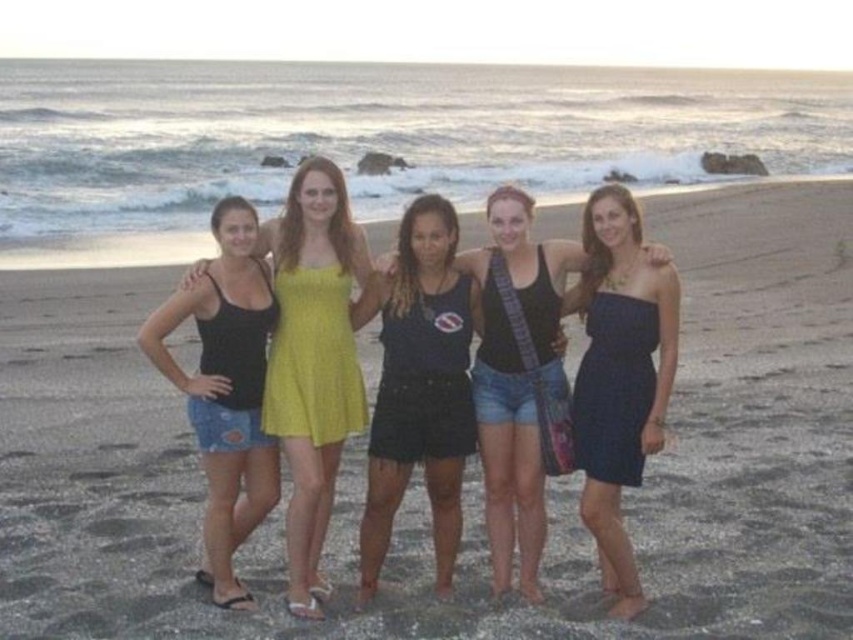
Based on the photo, you are standing on the beach and want to hand a towel to both the matte yellow dress at center and the denim shorts at left. Which person should you approach first to ensure you can reach them without moving further away?

You should approach the matte yellow dress at center first because it is closer to you than the denim shorts at left, so you can reach them without moving further away.

You are standing on the beach and want to walk towards both point (273,554) and point (235,289). Which point will you reach first?

You will reach point (273,554) first because it is closer to you than point (235,289).

You are planning to take a photo of the group on the beach. The photographer wants to ensure that the navy blue strapless dress at center and the denim shorts at left are both clearly visible in the frame. Given their widths, which of the two clothing items might require the photographer to adjust the camera angle to avoid being cropped out?

The navy blue strapless dress at center has a lesser width compared to denim shorts at left, so the denim shorts at left might require adjusting the camera angle to accommodate its wider width to prevent cropping.